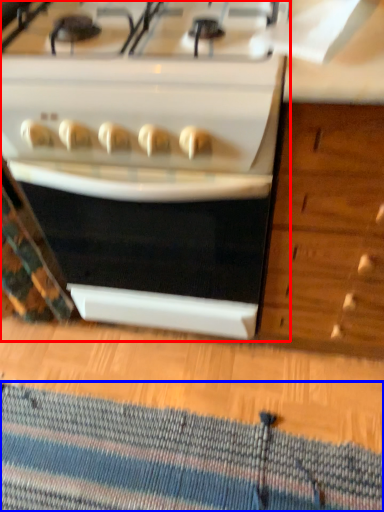
Question: Which of the following is the farthest to the observer, kitchen appliance (highlighted by a red box) or doormat (highlighted by a blue box)?

Choices:
 (A) kitchen appliance
 (B) doormat

Answer: (B)